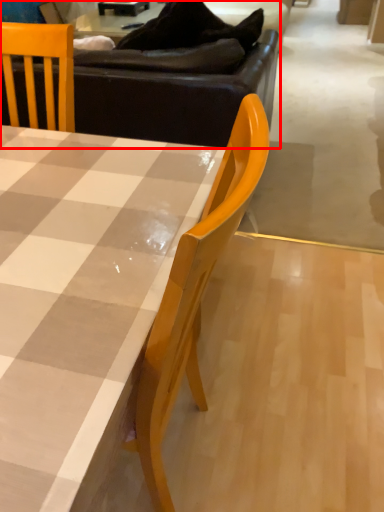
Question: Considering the relative positions of studio couch (annotated by the red box) and table in the image provided, where is studio couch (annotated by the red box) located with respect to the staircase?

Choices:
 (A) right
 (B) left

Answer: (A)